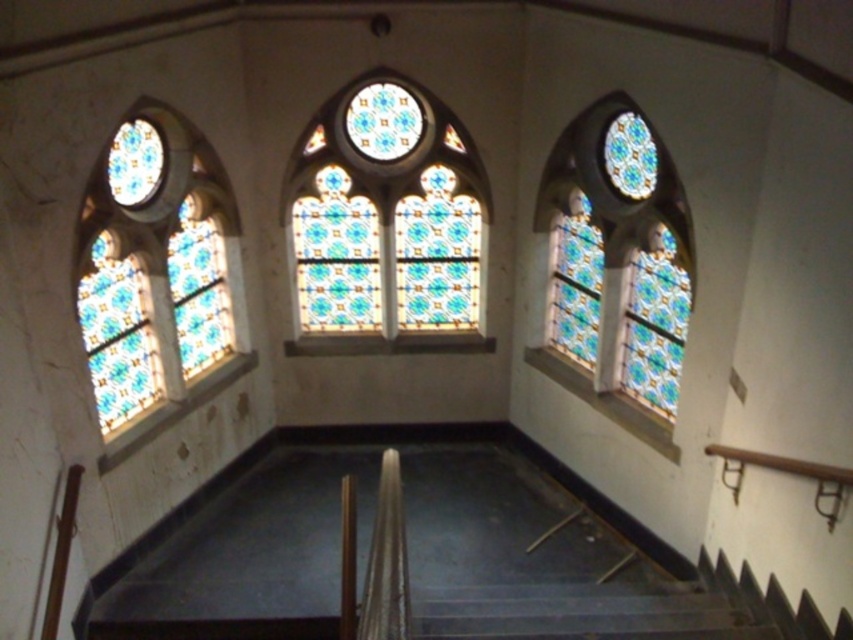
Consider the image. You are an architect assessing the stained glass windows in the cathedral. You notice the stained glass at center and the stained glass at right. Which of these two windows has a greater width?

The stained glass at center has a greater width than the stained glass at right, as stated in the description.

You are standing at the top of the staircase in the cathedral and notice two stained glass windows below you. The first is the stained glass at left and the second is the stained glass at center. Which of these two windows appears taller from your current vantage point?

The stained glass at left appears taller than the stained glass at center from your current vantage point at the top of the staircase.